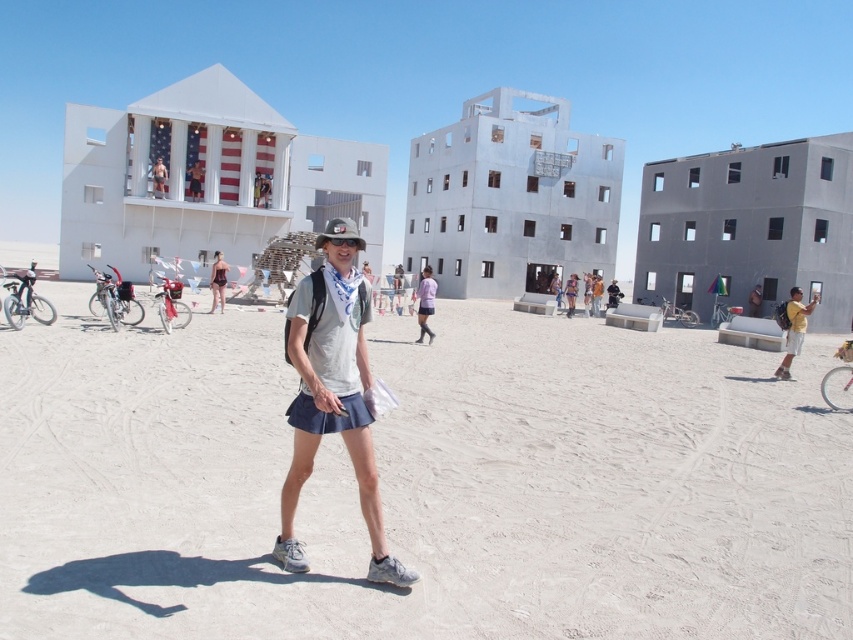
Question: Which of these objects is positioned closest to the white sand at center?

Choices:
 (A) black fabric hat at center
 (B) metallic silver figure at upper center
 (C) purple fabric skirt at center
 (D) gray fabric skirt at center

Answer: (D)

Question: Is purple fabric skirt at center positioned at the back of black fabric hat at center?

Choices:
 (A) no
 (B) yes

Answer: (B)

Question: Can you confirm if purple fabric skirt at center is positioned to the right of black fabric hat at center?

Choices:
 (A) no
 (B) yes

Answer: (B)

Question: Which of the following is the farthest from the observer?

Choices:
 (A) yellow backpack at lower right
 (B) black fabric hat at center
 (C) white sand at center
 (D) gray fabric skirt at center

Answer: (A)

Question: Which object is positioned farthest from the white sand at center?

Choices:
 (A) black fabric hat at center
 (B) gray fabric skirt at center

Answer: (A)

Question: Can you confirm if gray fabric skirt at center is positioned above yellow backpack at lower right?

Choices:
 (A) no
 (B) yes

Answer: (A)